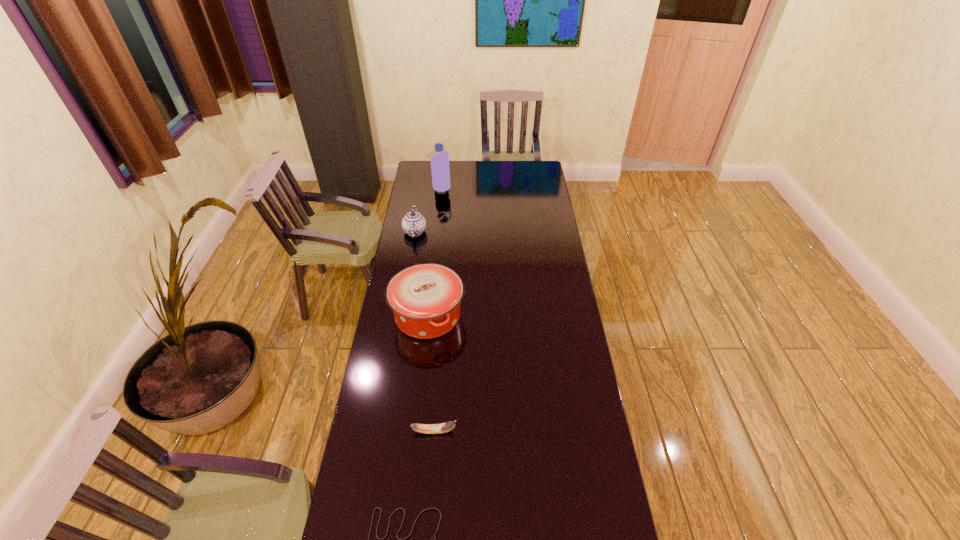
Where is `shampoo`? The image size is (960, 540). shampoo is located at coordinates (440, 169).

Identify the location of the tallest object. This screenshot has width=960, height=540. (440, 169).

This screenshot has width=960, height=540. Find the location of `the second tallest object`. the second tallest object is located at coordinates (425, 298).

At what (x,y) coordinates should I click in order to perform the action: click on the third farthest object. Please return your answer as a coordinate pair (x, y). Looking at the image, I should click on (425, 298).

Image resolution: width=960 pixels, height=540 pixels. What are the coordinates of `the third shortest object` in the screenshot? It's located at (413, 223).

I want to click on chinaware, so click(413, 223).

Find the location of a particular element. The image size is (960, 540). banana is located at coordinates (440, 428).

Find the location of a particular element. The width and height of the screenshot is (960, 540). blank space located on the front of the farthest object is located at coordinates (438, 203).

Where is `free spot located 0.280m on the back of the third farthest object`? This screenshot has height=540, width=960. free spot located 0.280m on the back of the third farthest object is located at coordinates (436, 247).

At what (x,y) coordinates should I click in order to perform the action: click on free space located at the spout of the third tallest object. Please return your answer as a coordinate pair (x, y). The image size is (960, 540). Looking at the image, I should click on (498, 232).